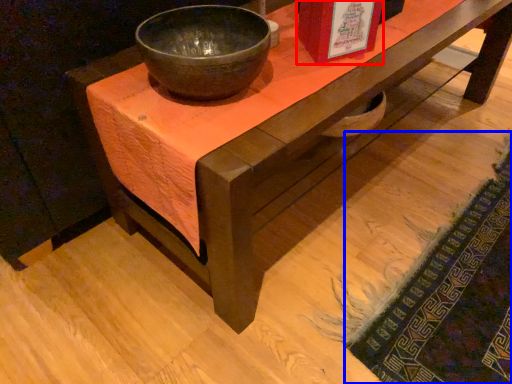
Question: Which object appears farthest to the camera in this image, book cover (highlighted by a red box) or mat (highlighted by a blue box)?

Choices:
 (A) book cover
 (B) mat

Answer: (A)